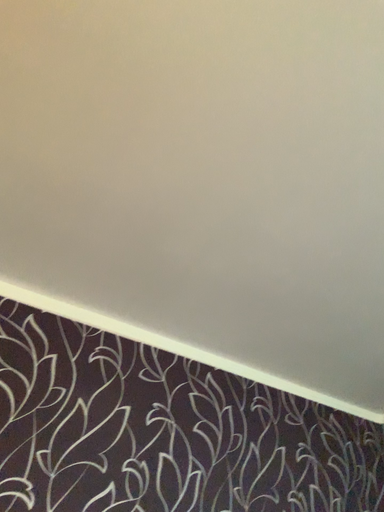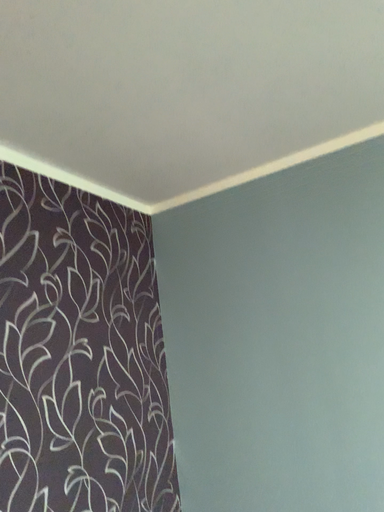
Question: Which way did the camera rotate in the video?

Choices:
 (A) rotated right
 (B) rotated left

Answer: (A)